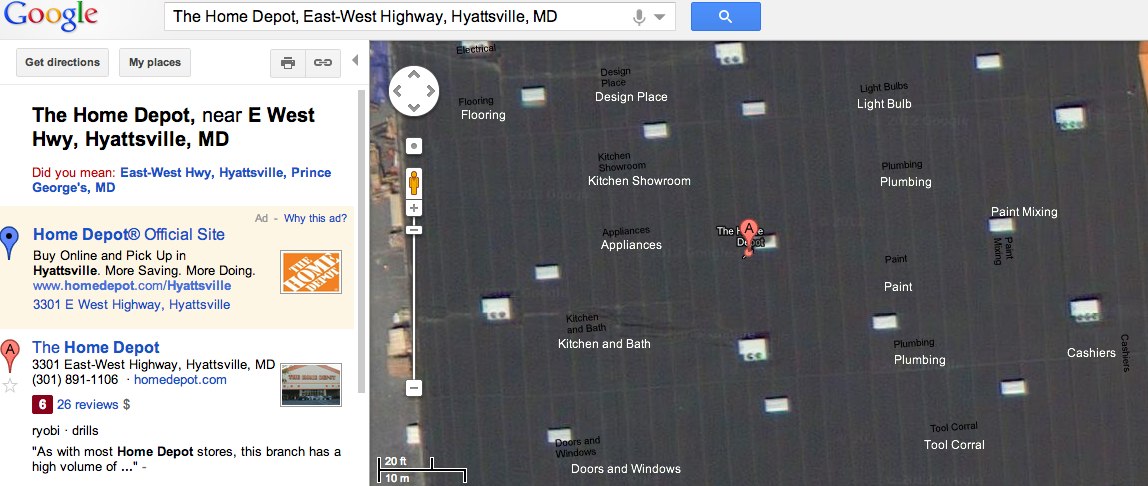
The height and width of the screenshot is (486, 1148). I want to click on appliances (text), so click(620, 249).